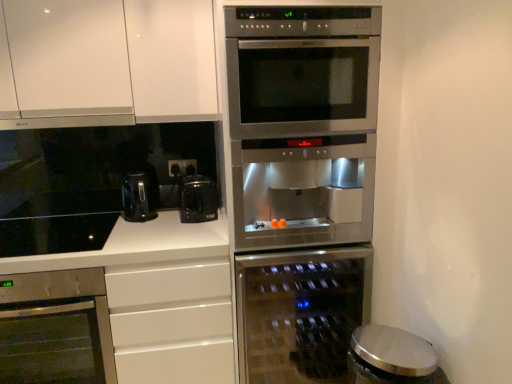
Question: Relative to stainless steel oven at lower left, positioned as the second oven in right-to-left order, is stainless steel oven at center, the second oven viewed from the left, in front or behind?

Choices:
 (A) front
 (B) behind

Answer: (B)

Question: Is stainless steel oven at center, the second oven viewed from the left, wider or thinner than stainless steel oven at lower left, acting as the first oven starting from the left?

Choices:
 (A) wide
 (B) thin

Answer: (B)

Question: Estimate the real-world distances between objects in this image. Which object is farther from the black glossy coffee maker at center?

Choices:
 (A) stainless steel oven at center, the first appliance from the back
 (B) stainless steel oven at lower left, positioned as the second oven in right-to-left order
 (C) stainless steel oven at center, which is the first oven from right to left
 (D) metallic silver trash can at lower right, which appears as the first appliance when viewed from the front
 (E) black glass cooktop at lower left

Answer: (D)

Question: Which is nearer to the stainless steel oven at center, which is the 2th appliance from front to back?

Choices:
 (A) black glass cooktop at lower left
 (B) stainless steel oven at lower left, positioned as the second oven in right-to-left order
 (C) white glossy countertop at lower left
 (D) black glossy coffee maker at center
 (E) black plastic electric outlet at center

Answer: (C)